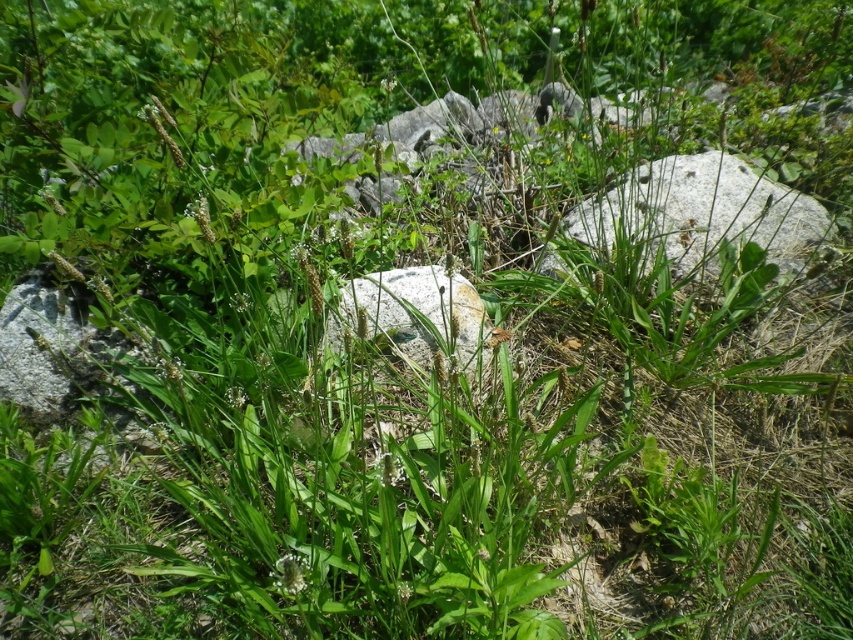
Can you confirm if gray rough stone at center is positioned above smooth gray rock at center?

Yes.

How much distance is there between gray rough stone at center and smooth gray rock at center?

gray rough stone at center is 24.23 inches from smooth gray rock at center.

This screenshot has height=640, width=853. In order to click on gray rough stone at center in this screenshot , I will do `click(703, 212)`.